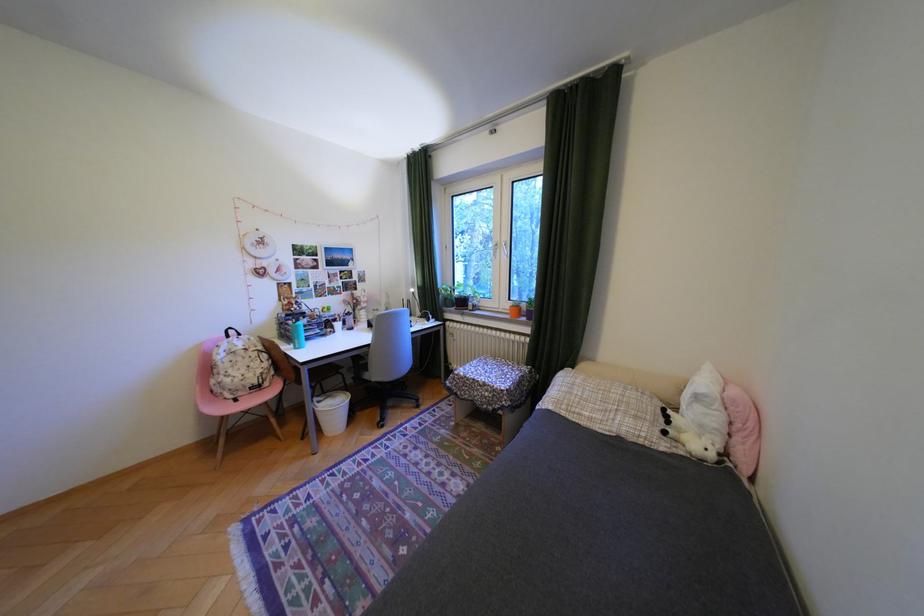
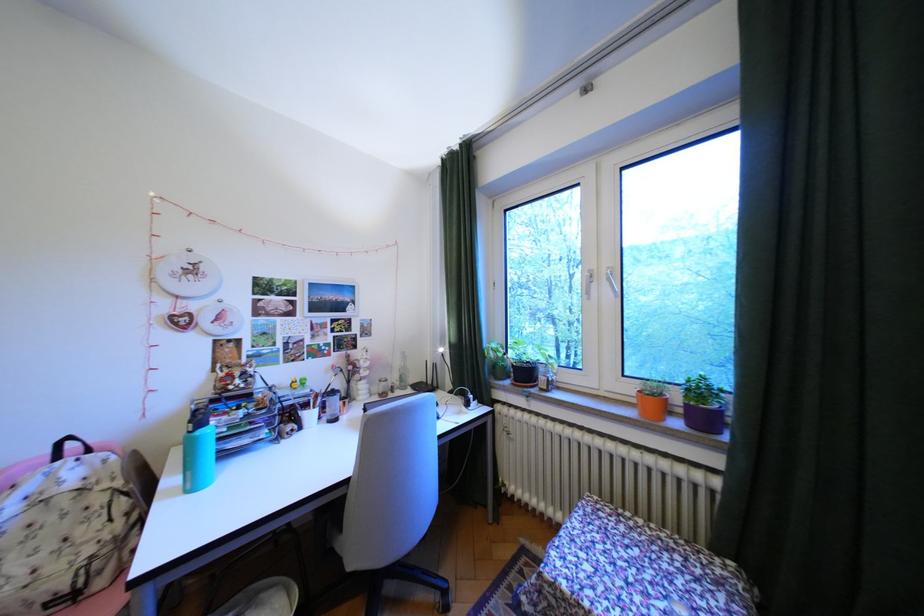
Find the pixel in the second image that matches (x=251, y=359) in the first image.

(65, 519)